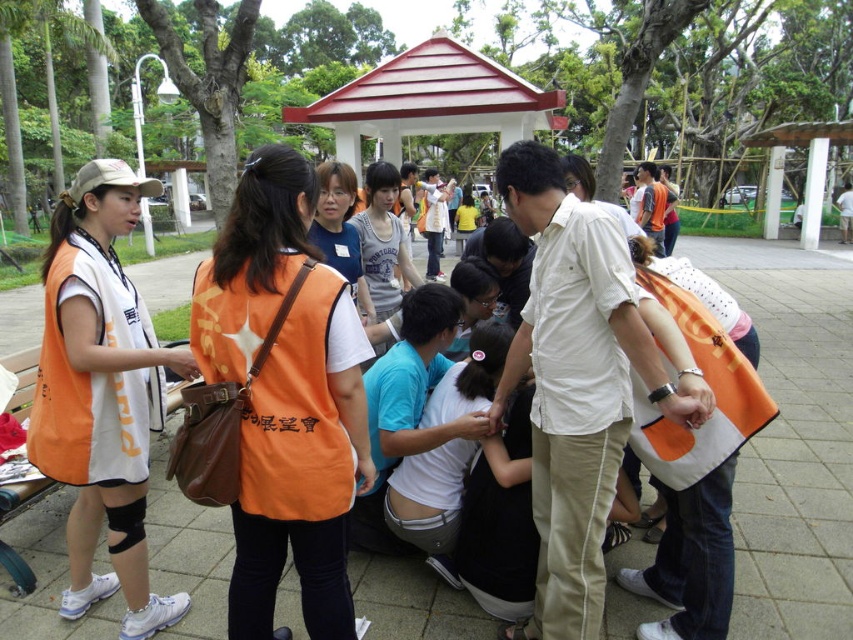
Can you confirm if orange fabric vest at center is positioned below orange fabric vest at left?

Yes, orange fabric vest at center is below orange fabric vest at left.

Who is positioned more to the right, orange fabric vest at center or orange fabric vest at left?

orange fabric vest at center

Which is in front, point (279, 417) or point (82, 380)?

Positioned in front is point (279, 417).

Locate an element on the screen. Image resolution: width=853 pixels, height=640 pixels. orange fabric vest at center is located at coordinates (285, 397).

Is orange fabric vest at left positioned at the back of white matte gazebo at center?

No, it is in front of white matte gazebo at center.

Describe the element at coordinates (102, 394) in the screenshot. I see `orange fabric vest at left` at that location.

Is point (61, 298) less distant than point (509, 97)?

Yes, point (61, 298) is in front of point (509, 97).

Identify the location of orange fabric vest at left. The height and width of the screenshot is (640, 853). (102, 394).

Where is `orange fabric vest at center`? The height and width of the screenshot is (640, 853). orange fabric vest at center is located at coordinates (285, 397).

Who is taller, orange fabric vest at center or white matte gazebo at center?

white matte gazebo at center

Between point (276, 448) and point (434, 108), which one is positioned in front?

Point (276, 448) is more forward.

You are a GUI agent. You are given a task and a screenshot of the screen. Output one action in this format:
    pyautogui.click(x=<x>, y=<y>)
    Task: Click on the orange fabric vest at center
    The image size is (853, 640).
    Given the screenshot: What is the action you would take?
    pyautogui.click(x=285, y=397)